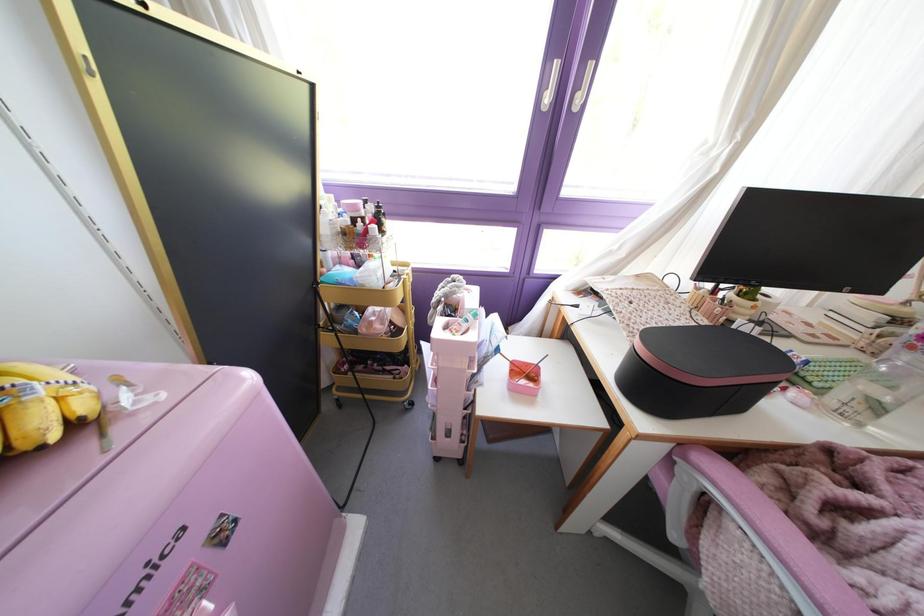
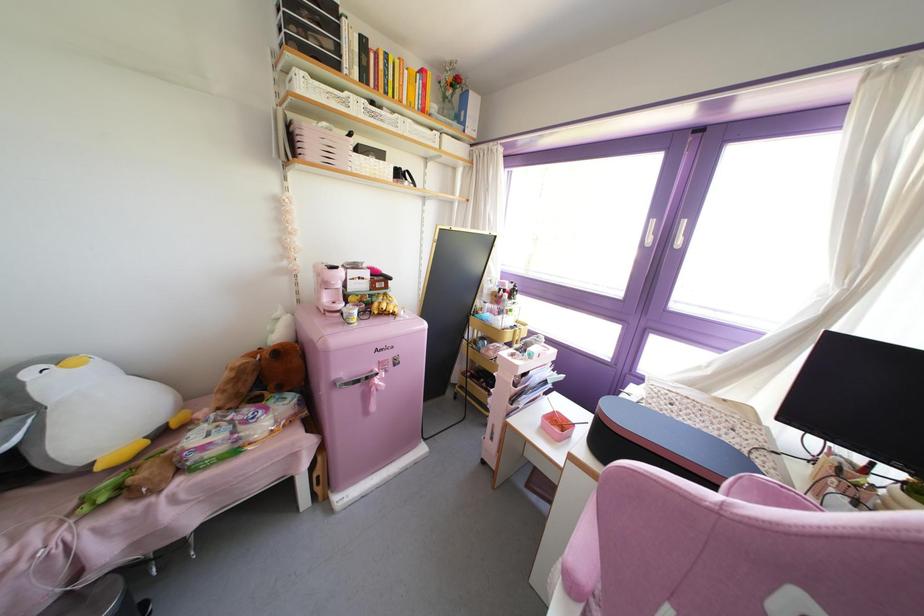
Locate, in the second image, the point that corresponds to point (524, 363) in the first image.

(565, 418)